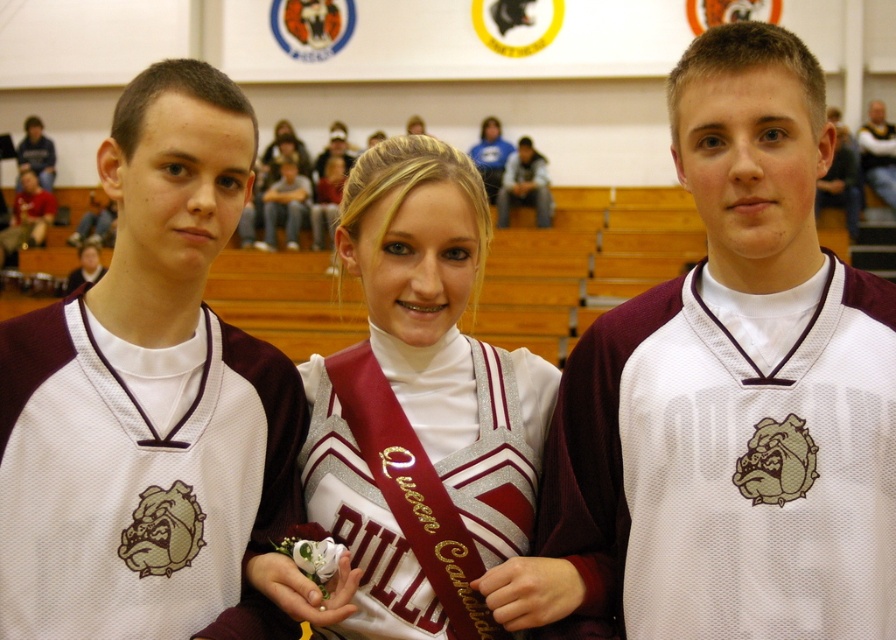
Question: Which point is farther to the camera?

Choices:
 (A) (48, 176)
 (B) (92, 262)
 (C) (812, 259)

Answer: (A)

Question: Considering the real-world distances, which object is farthest from the white jersey at center?

Choices:
 (A) white satin sash at center
 (B) matte gray jeans at center
 (C) blue cotton hoodie at upper left

Answer: (C)

Question: Which object appears closest to the camera in this image?

Choices:
 (A) maroon jersey at left
 (B) blue cotton hoodie at upper left
 (C) white mesh jersey at center
 (D) dark gray jeans at center

Answer: (A)

Question: Is blue cotton hoodie at upper left smaller than matte white jersey at center?

Choices:
 (A) yes
 (B) no

Answer: (B)

Question: Can you confirm if dark gray jeans at center is positioned above white satin sash at center?

Choices:
 (A) yes
 (B) no

Answer: (A)

Question: Does dark gray jeans at center have a smaller size compared to matte gray jeans at center?

Choices:
 (A) no
 (B) yes

Answer: (B)